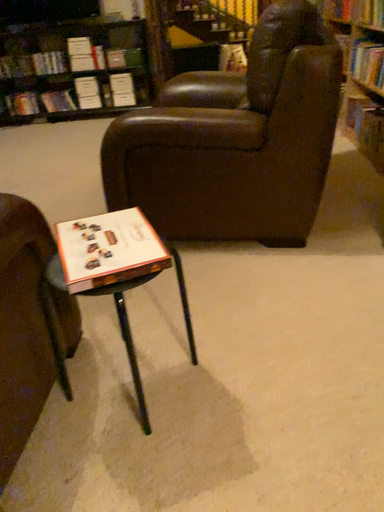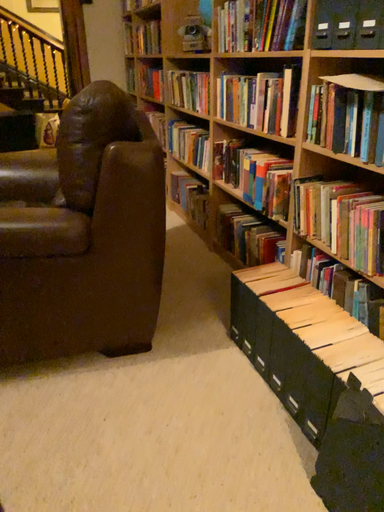
Question: Which way did the camera rotate in the video?

Choices:
 (A) rotated upward
 (B) rotated downward

Answer: (A)